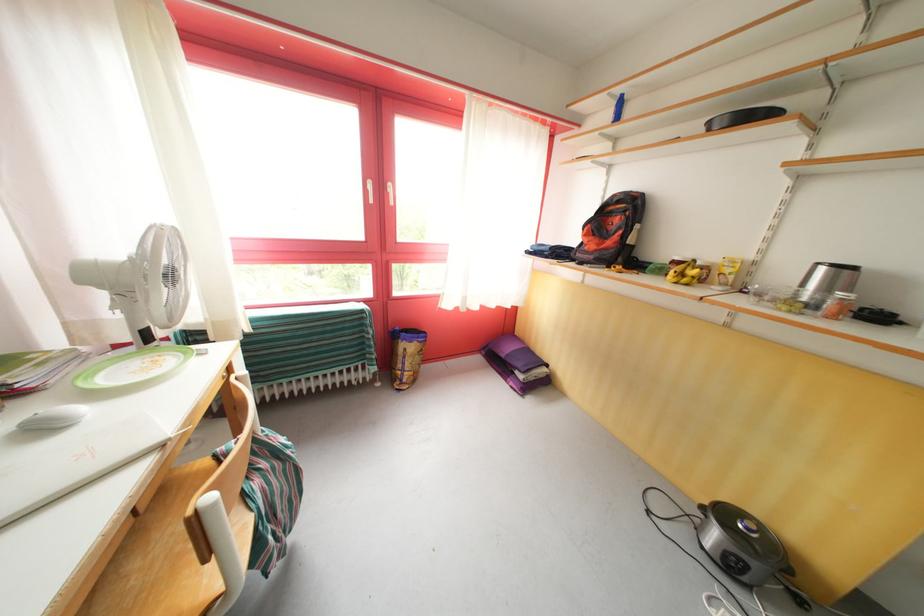
This screenshot has width=924, height=616. Describe the element at coordinates (132, 367) in the screenshot. I see `a green plate` at that location.